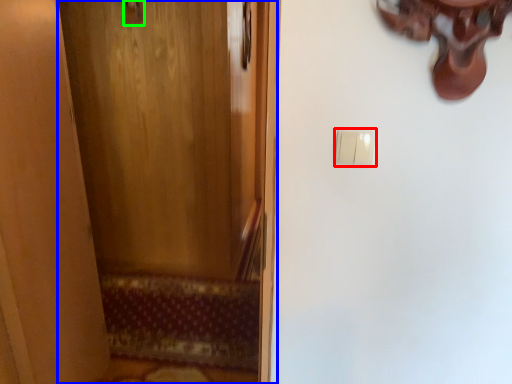
Question: Based on their relative distances, which object is nearer to light switch (highlighted by a red box)? Choose from door (highlighted by a blue box) and door handle (highlighted by a green box).

Choices:
 (A) door
 (B) door handle

Answer: (B)